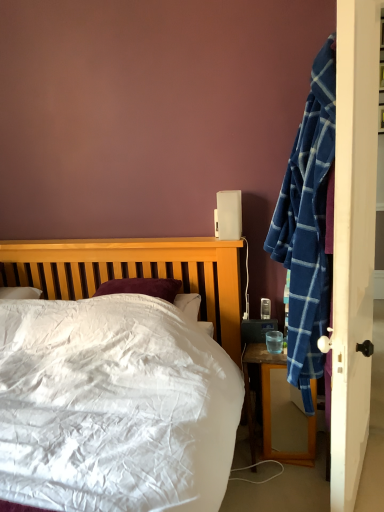
Question: Is clear glass cup at nightstand right completely or partially outside of white plastic speaker at upper right?

Choices:
 (A) yes
 (B) no

Answer: (A)

Question: From the image's perspective, does clear glass cup at nightstand right appear lower than white plastic speaker at upper right?

Choices:
 (A) no
 (B) yes

Answer: (B)

Question: Is clear glass cup at nightstand right turned away from white plastic speaker at upper right?

Choices:
 (A) yes
 (B) no

Answer: (B)

Question: Is clear glass cup at nightstand right shorter than white plastic speaker at upper right?

Choices:
 (A) yes
 (B) no

Answer: (A)

Question: From the image's perspective, is clear glass cup at nightstand right on top of white plastic speaker at upper right?

Choices:
 (A) no
 (B) yes

Answer: (A)

Question: Is clear glass cup at nightstand right not near white plastic speaker at upper right?

Choices:
 (A) yes
 (B) no

Answer: (B)

Question: From the image's perspective, is white plastic speaker at upper right located above wooden desk at right?

Choices:
 (A) yes
 (B) no

Answer: (A)

Question: Considering the relative sizes of white plastic speaker at upper right and wooden desk at right in the image provided, is white plastic speaker at upper right wider than wooden desk at right?

Choices:
 (A) yes
 (B) no

Answer: (B)

Question: Is white plastic speaker at upper right to the right of wooden desk at right from the viewer's perspective?

Choices:
 (A) yes
 (B) no

Answer: (B)

Question: Is white plastic speaker at upper right touching wooden desk at right?

Choices:
 (A) no
 (B) yes

Answer: (A)

Question: Is white plastic speaker at upper right positioned with its back to wooden desk at right?

Choices:
 (A) yes
 (B) no

Answer: (B)

Question: Considering the relative sizes of white plastic speaker at upper right and wooden desk at right in the image provided, is white plastic speaker at upper right taller than wooden desk at right?

Choices:
 (A) yes
 (B) no

Answer: (B)

Question: From the image's perspective, does wooden desk at right appear higher than clear glass cup at nightstand right?

Choices:
 (A) yes
 (B) no

Answer: (B)